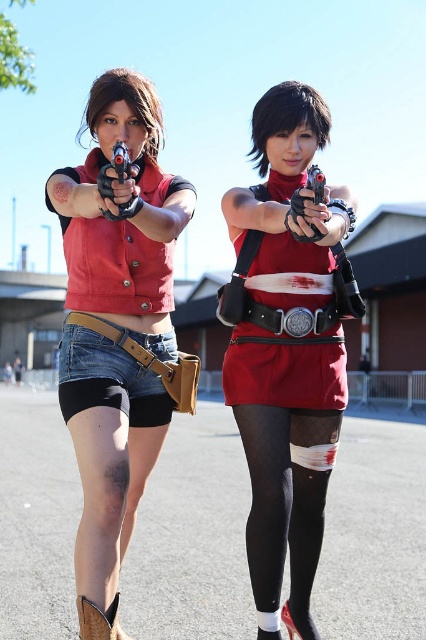
What is the exact coordinate of the black mesh tights at lower center?

The black mesh tights at lower center is located at coordinate point [285,506].

You are a photographer setting up a shoot with two cosplayers. You need to ensure that the matte red vest at center is visible in the frame. Since the black plastic toy gun at upper center might block it, where should you position the camera relative to the cosplayers?

The matte red vest at center is positioned on the right side of the black plastic toy gun at upper center, so positioning the camera to the right side of the cosplayers would allow the vest to be seen without obstruction from the gun.